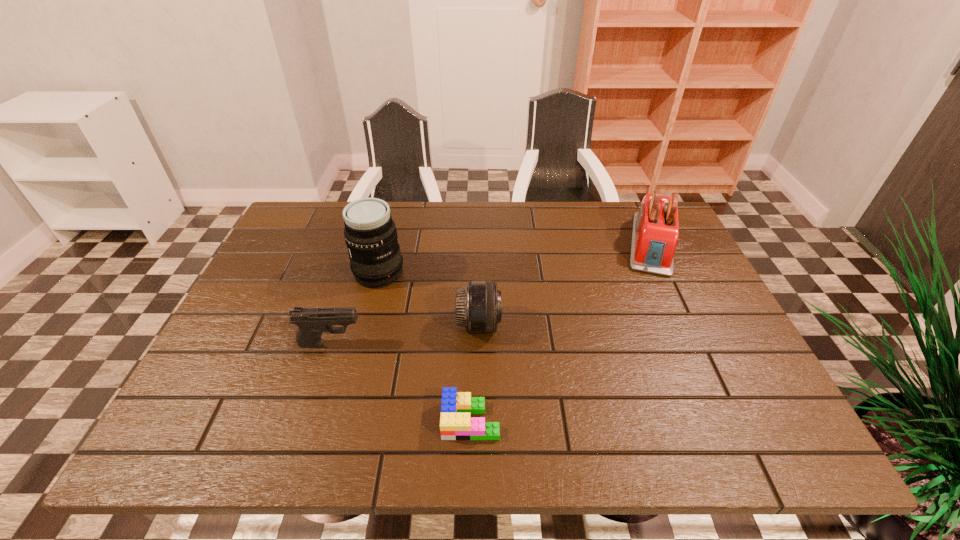
Where is `vacant region located on the front of the rightmost object`? This screenshot has height=540, width=960. vacant region located on the front of the rightmost object is located at coordinates (685, 316).

This screenshot has width=960, height=540. I want to click on free space located 0.340m on the front-facing side of the shorter telephoto lens, so click(642, 325).

The image size is (960, 540). Find the location of `vacant space located at the barrel of the pistol`. vacant space located at the barrel of the pistol is located at coordinates (424, 343).

At what (x,y) coordinates should I click in order to perform the action: click on vacant area situated 0.050m on the right of the shortest object. Please return your answer as a coordinate pair (x, y). Image resolution: width=960 pixels, height=540 pixels. Looking at the image, I should click on (524, 420).

Where is `object that is at the far edge`? object that is at the far edge is located at coordinates (655, 234).

Locate an element on the screen. The width and height of the screenshot is (960, 540). object positioned at the near edge is located at coordinates (455, 422).

Where is `object present at the right edge`? The image size is (960, 540). object present at the right edge is located at coordinates (655, 234).

Identify the location of object that is at the far right corner. This screenshot has width=960, height=540. (655, 234).

Locate an element on the screen. This screenshot has height=540, width=960. free space at the far edge of the desktop is located at coordinates (510, 229).

Locate an element on the screen. Image resolution: width=960 pixels, height=540 pixels. vacant space at the near edge of the desktop is located at coordinates (566, 420).